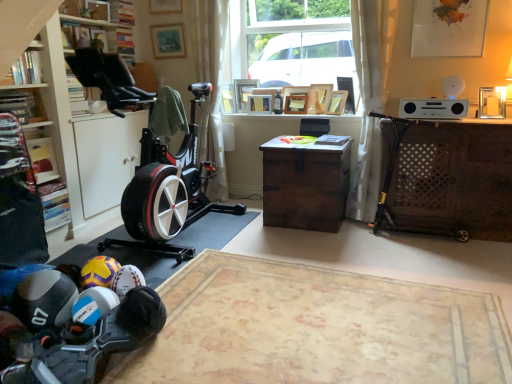
The height and width of the screenshot is (384, 512). Identify the location of vacant area that lies between wooden desk at right, the second desk in the left-to-right sequence, and rubberized black shoe at lower left, arranged as the 2th toy when viewed from the back. (333, 264).